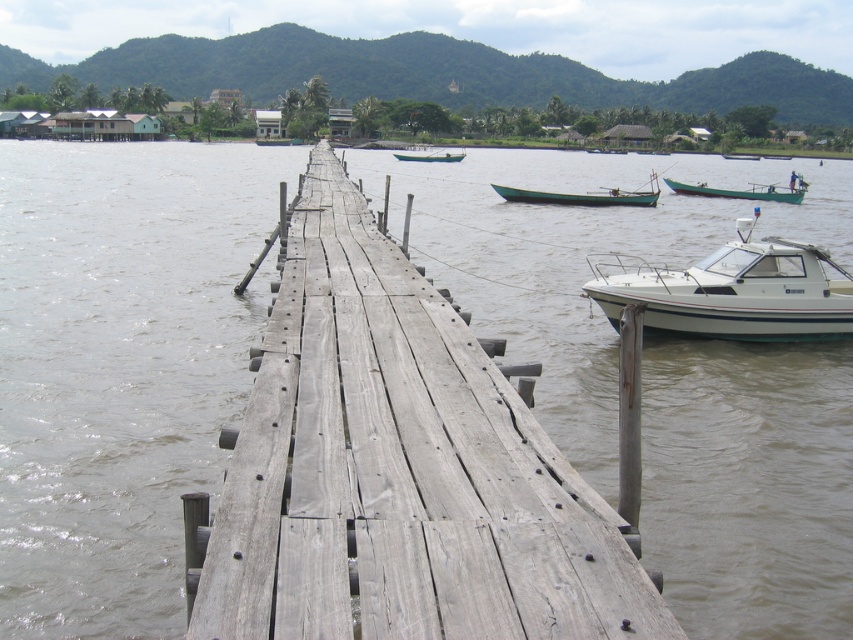
Can you confirm if green wooden boat at center is positioned to the right of green matte boat at center?

Yes, green wooden boat at center is to the right of green matte boat at center.

Looking at this image, between green wooden boat at center and green matte boat at center, which one appears on the left side from the viewer's perspective?

green matte boat at center

Is point (596, 196) farther from camera compared to point (419, 145)?

No.

Where is `green wooden boat at center`? The image size is (853, 640). green wooden boat at center is located at coordinates (583, 195).

How distant is green matte boat at right from green matte boat at center?

The distance of green matte boat at right from green matte boat at center is 53.90 meters.

Can you confirm if green matte boat at right is positioned above green matte boat at center?

Actually, green matte boat at right is below green matte boat at center.

Describe the element at coordinates (735, 193) in the screenshot. I see `green matte boat at right` at that location.

Identify the location of green matte boat at right. (735, 193).

Between weathered wood bridge at center and white glossy boat at right, which one has more height?

With more height is weathered wood bridge at center.

Which is in front, point (531, 596) or point (676, 284)?

Positioned in front is point (531, 596).

What are the coordinates of `weathered wood bridge at center` in the screenshot? It's located at (398, 468).